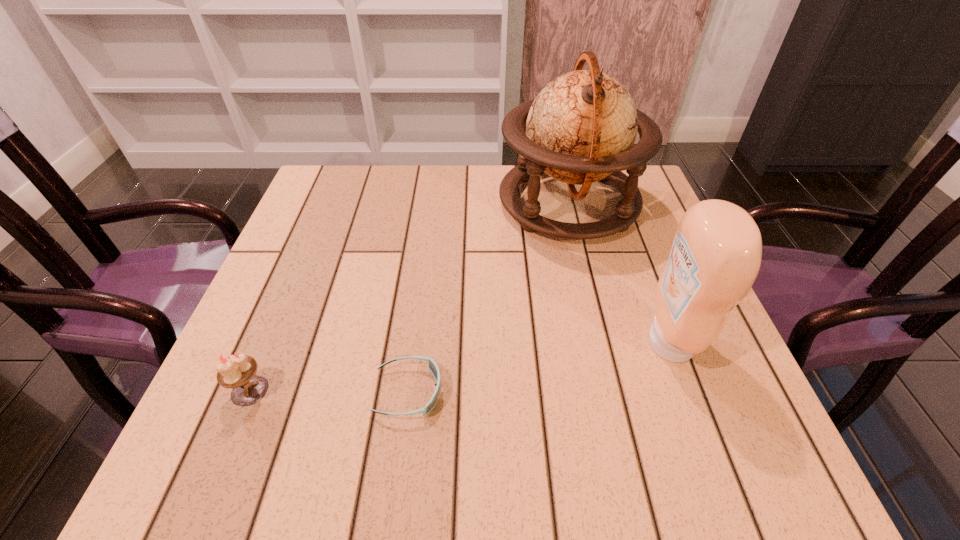
Locate an element on the screen. The width and height of the screenshot is (960, 540). empty space that is in between the third object from right to left and the third tallest object is located at coordinates (329, 391).

I want to click on vacant space in between the farthest object and the shortest object, so click(x=489, y=297).

At what (x,y) coordinates should I click in order to perform the action: click on free point between the third object from right to left and the globe. Please return your answer as a coordinate pair (x, y). The width and height of the screenshot is (960, 540). Looking at the image, I should click on (489, 297).

Where is `free spot between the globe and the condiment`? Image resolution: width=960 pixels, height=540 pixels. free spot between the globe and the condiment is located at coordinates (619, 272).

Locate an element on the screen. This screenshot has width=960, height=540. free spot between the goggles and the second shortest object is located at coordinates (329, 391).

Identify which object is the nearest to the third tallest object. Please provide its 2D coordinates. Your answer should be formatted as a tuple, i.e. [(x, y)], where the tuple contains the x and y coordinates of a point satisfying the conditions above.

[(432, 366)]

Locate which object ranks second in proximity to the third object from right to left. Please provide its 2D coordinates. Your answer should be formatted as a tuple, i.e. [(x, y)], where the tuple contains the x and y coordinates of a point satisfying the conditions above.

[(581, 128)]

Where is `free space in the image that satisfies the following two spatial constraints: 1. on the front side of the farthest object; 2. on the front-facing side of the second object from left to right`? Image resolution: width=960 pixels, height=540 pixels. free space in the image that satisfies the following two spatial constraints: 1. on the front side of the farthest object; 2. on the front-facing side of the second object from left to right is located at coordinates (614, 392).

This screenshot has height=540, width=960. Find the location of `free spot that satisfies the following two spatial constraints: 1. on the label of the condiment; 2. on the front side of the second shortest object`. free spot that satisfies the following two spatial constraints: 1. on the label of the condiment; 2. on the front side of the second shortest object is located at coordinates (687, 390).